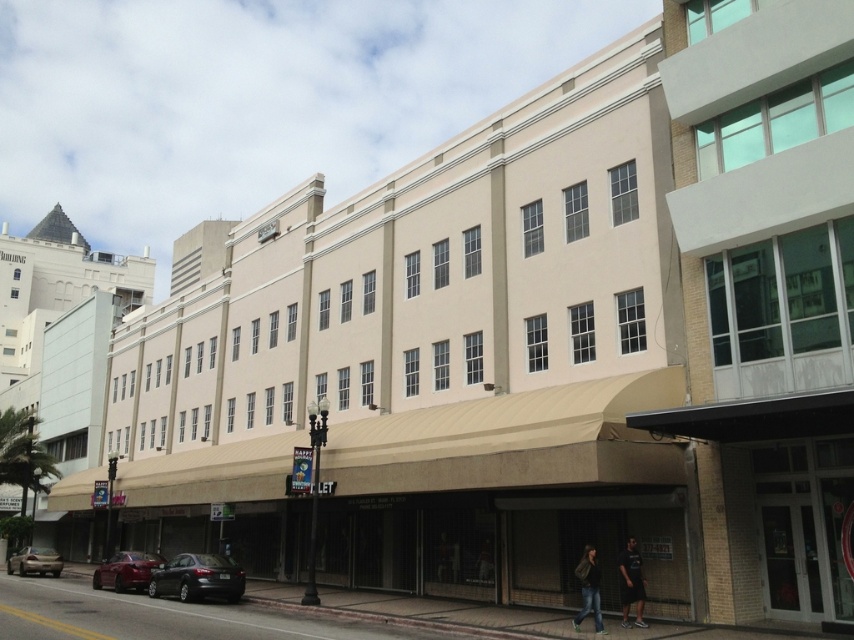
Looking at this image, does shiny red sedan at lower left appear on the left side of dark gray t-shirt at lower right?

Yes, shiny red sedan at lower left is to the left of dark gray t-shirt at lower right.

Is point (94, 572) in front of point (619, 560)?

No, (94, 572) is further to viewer.

Where is `shiny red sedan at lower left`? shiny red sedan at lower left is located at coordinates (126, 570).

Is white glass windows at upper center smaller than green fabric jacket at lower center?

Incorrect, white glass windows at upper center is not smaller in size than green fabric jacket at lower center.

From the picture: Is white glass windows at upper center behind green fabric jacket at lower center?

No, it is not.

Does point (835, 316) come behind point (598, 572)?

No, (835, 316) is closer to viewer.

The width and height of the screenshot is (854, 640). I want to click on white glass windows at upper center, so click(765, 298).

Does white glass windows at upper center appear over dark gray t-shirt at lower right?

Yes, white glass windows at upper center is above dark gray t-shirt at lower right.

Can you confirm if white glass windows at upper center is positioned to the left of dark gray t-shirt at lower right?

No, white glass windows at upper center is not to the left of dark gray t-shirt at lower right.

Is point (706, 512) farther from viewer compared to point (619, 554)?

That is True.

Locate an element on the screen. white glass windows at upper center is located at coordinates (765, 298).